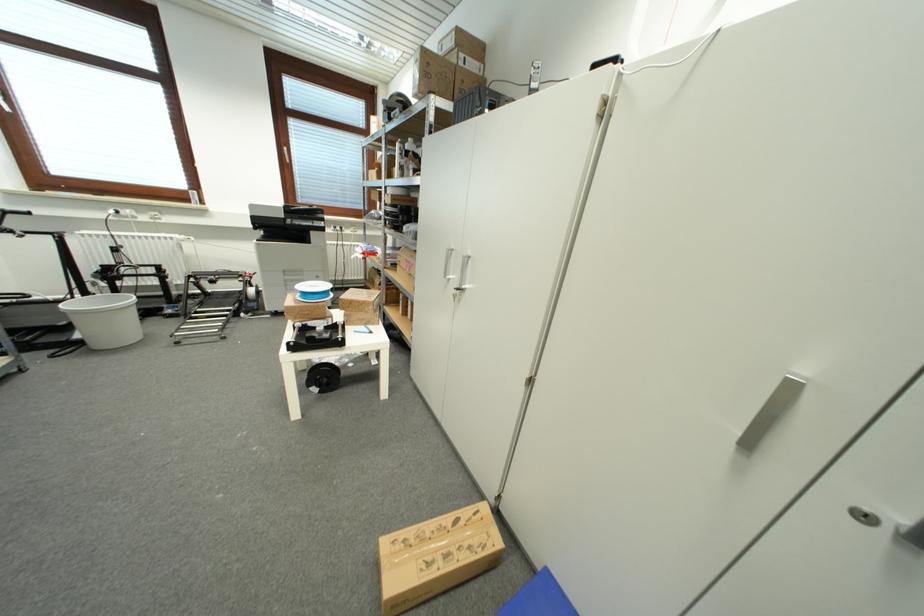
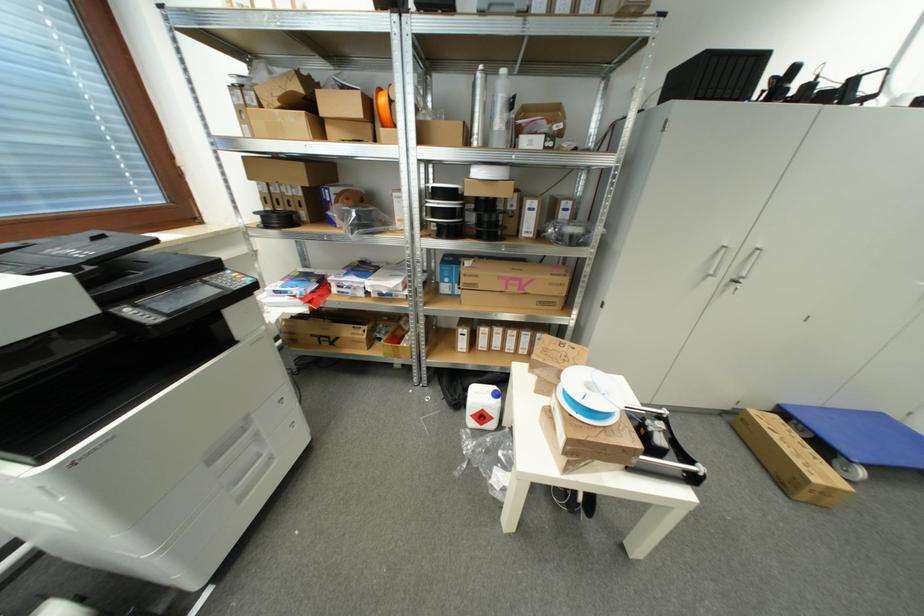
The point at (321, 289) is marked in the first image. Where is the corresponding point in the second image?

(594, 387)